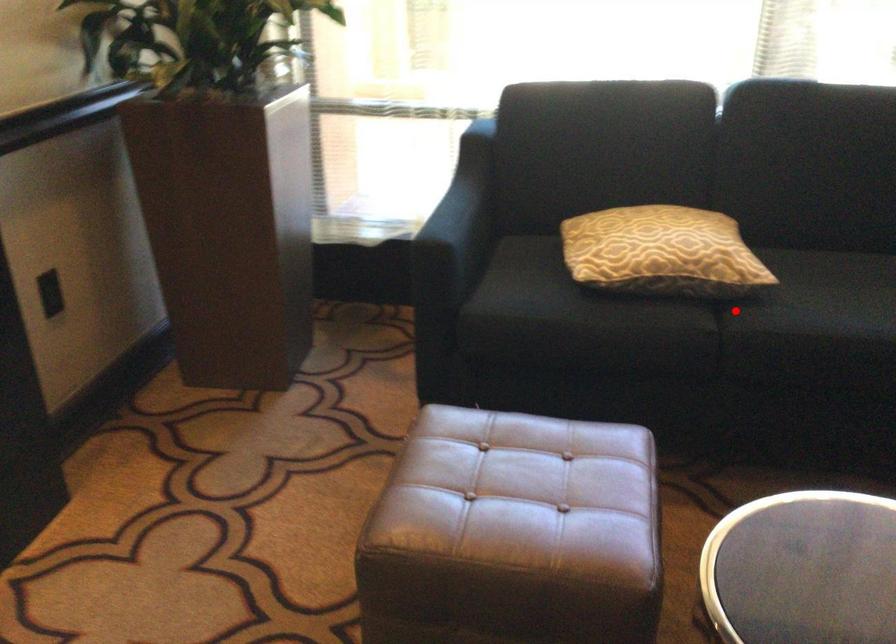
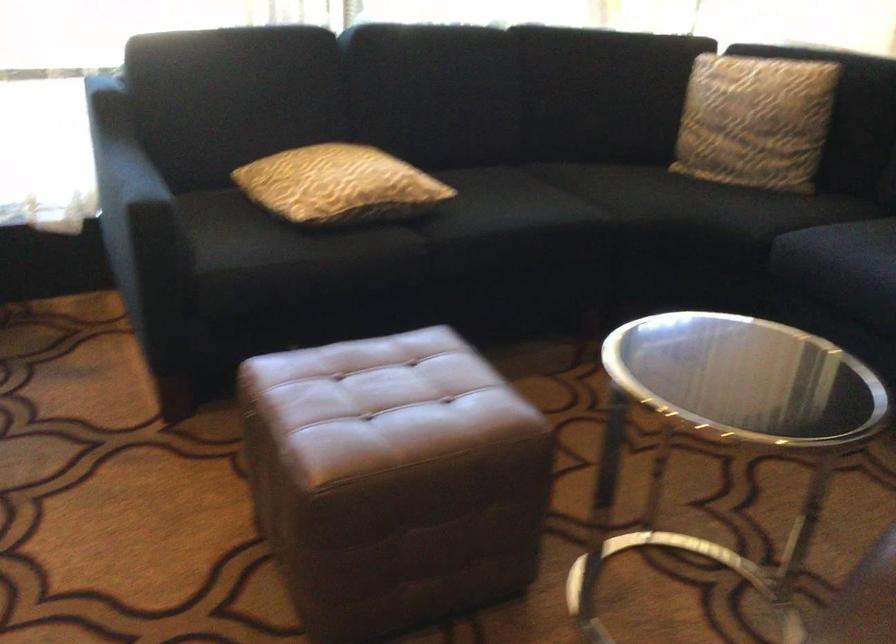
Locate, in the second image, the point that corresponds to the highlighted location in the first image.

(426, 227)